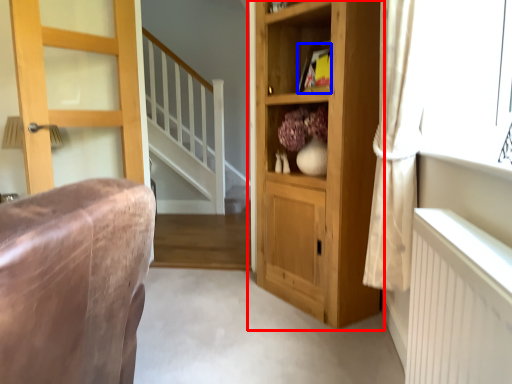
Question: Which of the following is the closest to the observer, cupboard (highlighted by a red box) or book (highlighted by a blue box)?

Choices:
 (A) cupboard
 (B) book

Answer: (A)